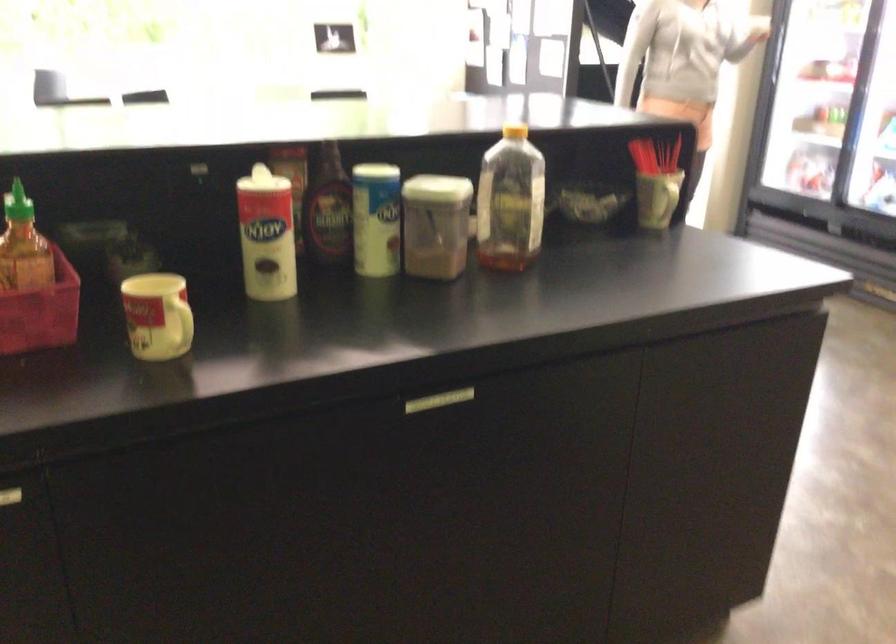
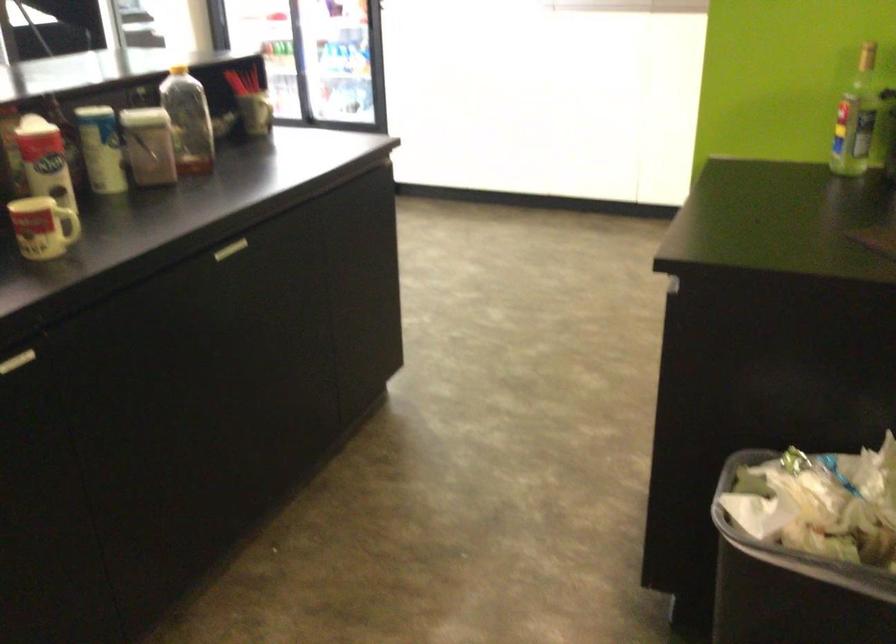
Where in the second image is the point corresponding to [268,194] from the first image?

(16, 149)